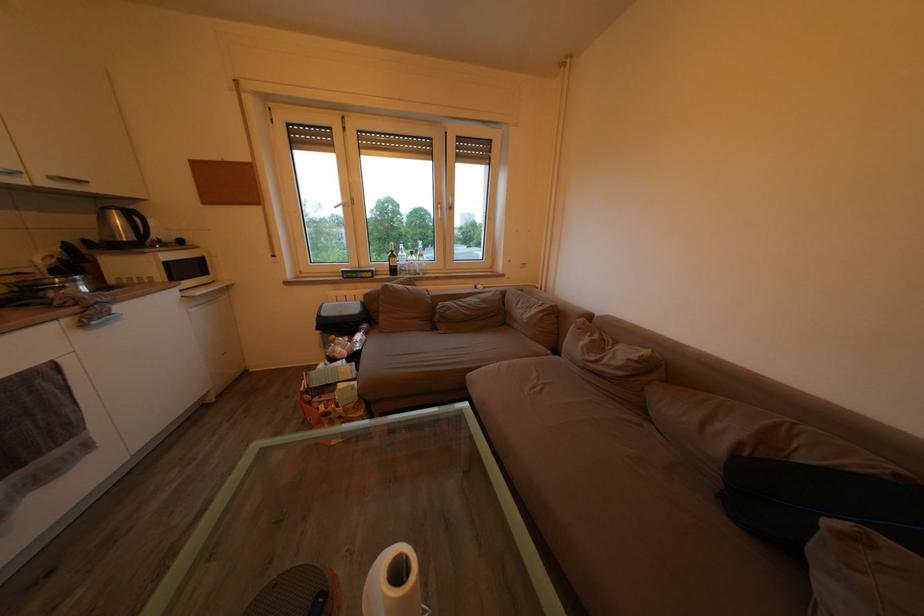
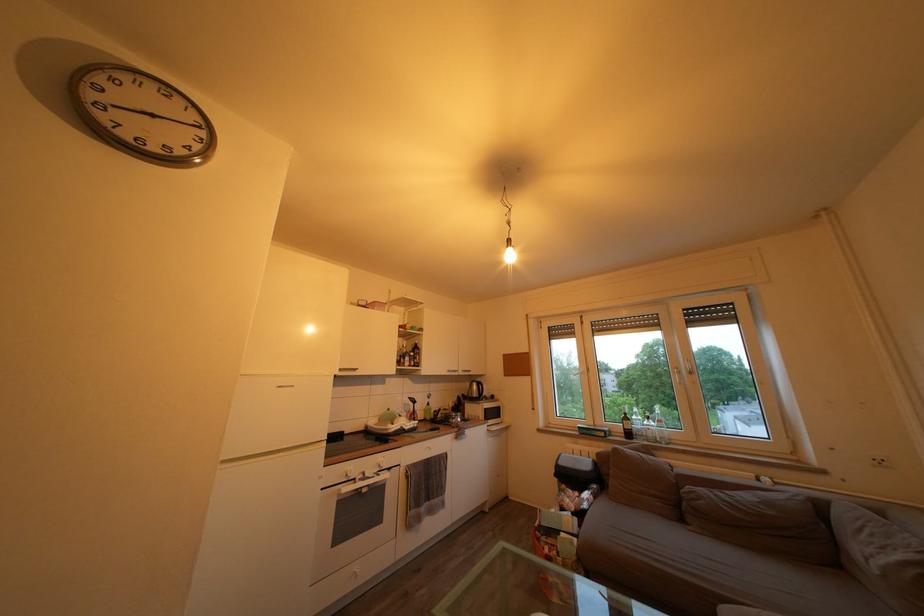
Locate, in the second image, the point that corresponds to [400,262] in the first image.

(635, 424)